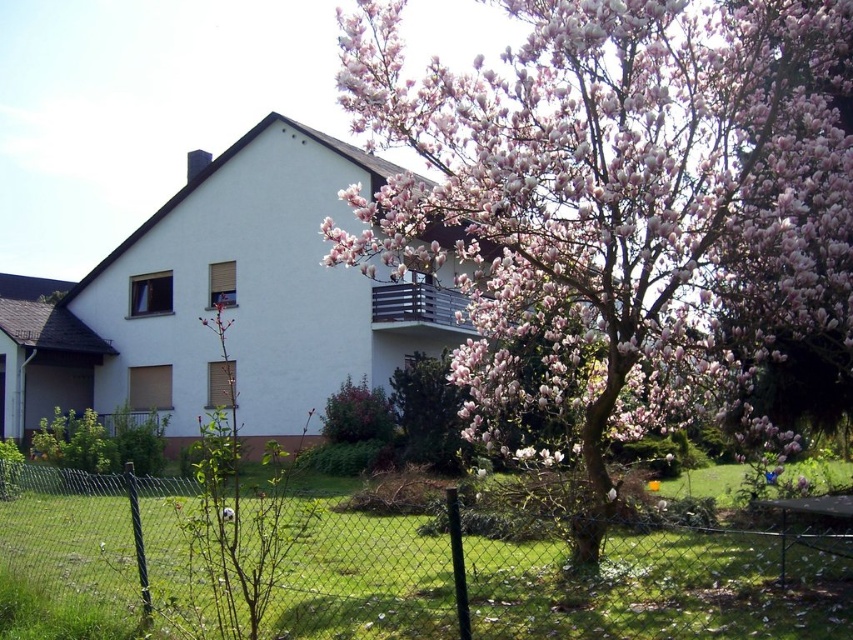
Question: Which of the following is the farthest from the observer?

Choices:
 (A) pink blossoming tree at center
 (B) black metal balcony at upper center
 (C) green chain-link fence at lower center

Answer: (B)

Question: In this image, where is pink blossoming tree at center located relative to black metal balcony at upper center?

Choices:
 (A) left
 (B) right

Answer: (B)

Question: Does pink blossoming tree at center appear on the right side of black metal balcony at upper center?

Choices:
 (A) no
 (B) yes

Answer: (B)

Question: Which point appears closest to the camera in this image?

Choices:
 (A) (770, 20)
 (B) (383, 308)

Answer: (A)

Question: Which object is positioned farthest from the black metal balcony at upper center?

Choices:
 (A) pink blossoming tree at center
 (B) green chain-link fence at lower center

Answer: (A)

Question: In this image, where is pink blossoming tree at center located relative to black metal balcony at upper center?

Choices:
 (A) left
 (B) right

Answer: (B)